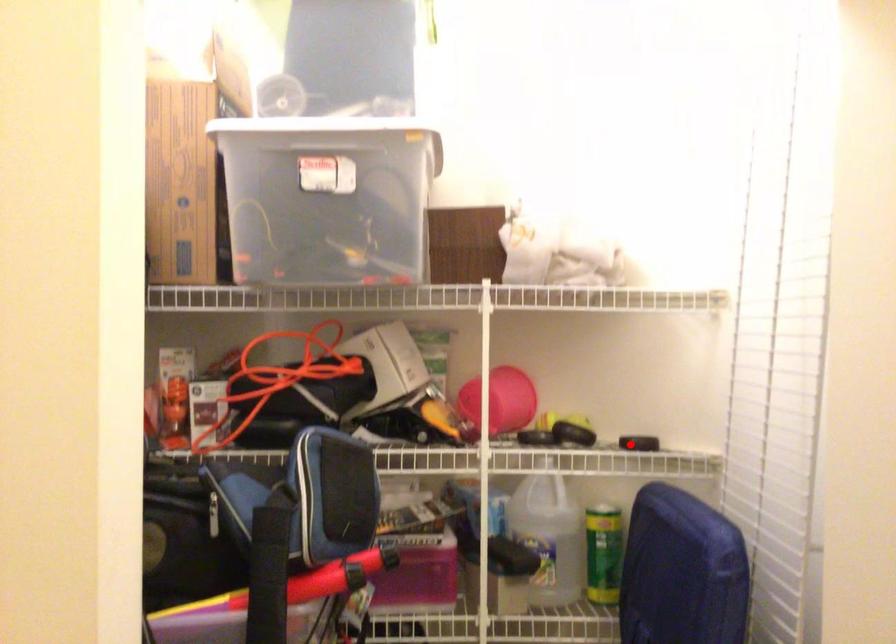
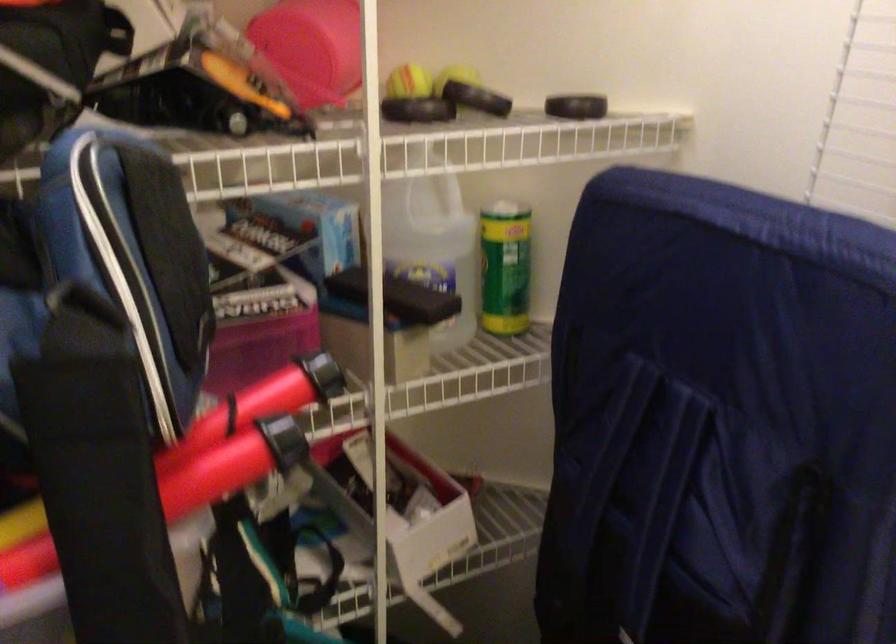
Locate, in the second image, the point that corresponds to the highlighted location in the first image.

(576, 106)